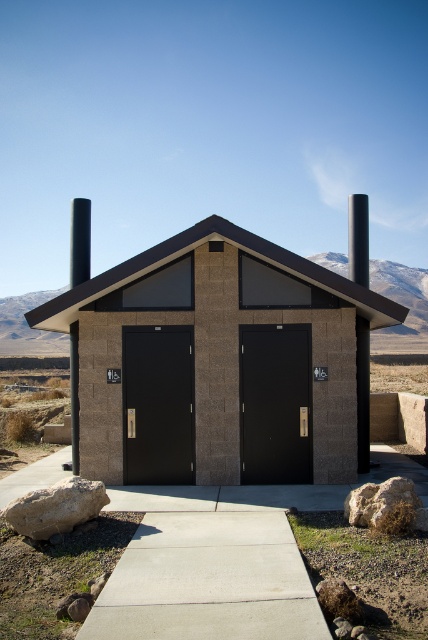
Question: Can you confirm if brown textured concrete hut at center is positioned above black matte door at center?

Choices:
 (A) yes
 (B) no

Answer: (A)

Question: Can you confirm if brown textured concrete hut at center is positioned to the right of matte black door at center?

Choices:
 (A) yes
 (B) no

Answer: (B)

Question: Is brown textured concrete hut at center thinner than black matte door at center?

Choices:
 (A) no
 (B) yes

Answer: (A)

Question: Which point is closer to the camera taking this photo?

Choices:
 (A) click(x=220, y=444)
 (B) click(x=166, y=445)

Answer: (A)

Question: Which object is closer to the camera taking this photo?

Choices:
 (A) brown textured concrete hut at center
 (B) matte black door at center

Answer: (B)

Question: Which point is farther to the camera?

Choices:
 (A) brown textured concrete hut at center
 (B) matte black door at center
 (C) black matte door at center

Answer: (A)